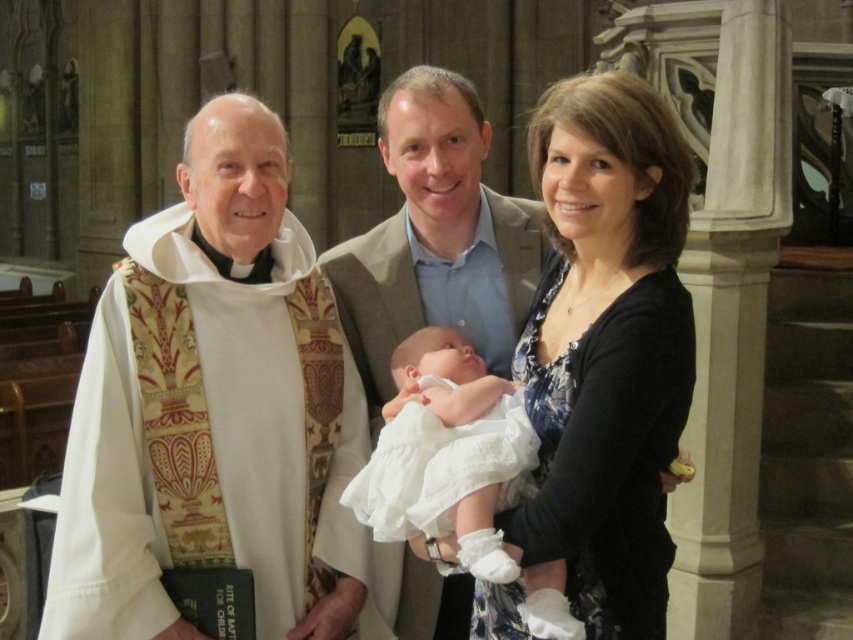
Can you confirm if white silk vestment at left is smaller than white cotton dress at center?

Correct, white silk vestment at left occupies less space than white cotton dress at center.

Does white silk vestment at left lie behind white cotton dress at center?

Yes, white silk vestment at left is behind white cotton dress at center.

Is point (279, 472) positioned before point (405, 484)?

That is False.

The image size is (853, 640). I want to click on white silk vestment at left, so click(x=218, y=413).

Does white silk vestment at left have a lesser width compared to light brown textured suit at center?

Correct, white silk vestment at left's width is less than light brown textured suit at center's.

Who is positioned more to the left, white silk vestment at left or light brown textured suit at center?

light brown textured suit at center is more to the left.

In order to click on white silk vestment at left in this screenshot , I will do click(x=218, y=413).

Is white silk vestment at left bigger than black floral dress at center?

No, white silk vestment at left is not bigger than black floral dress at center.

Between white silk vestment at left and black floral dress at center, which one has more height?

With more height is black floral dress at center.

Who is more distant from viewer, (163, 346) or (625, 435)?

The point (163, 346) is more distant.

Image resolution: width=853 pixels, height=640 pixels. What are the coordinates of `white silk vestment at left` in the screenshot? It's located at (218, 413).